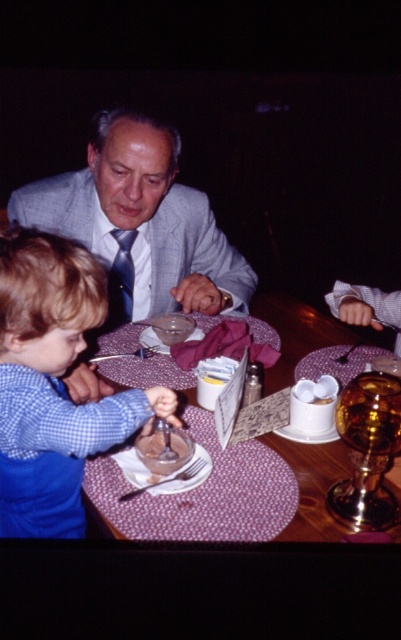
Question: Is wooden table at center in front of smooth chocolate pudding at center?

Choices:
 (A) no
 (B) yes

Answer: (B)

Question: Does blue checkered shirt at lower left have a larger size compared to smooth chocolate pudding at center?

Choices:
 (A) yes
 (B) no

Answer: (A)

Question: Which of the following is the farthest from the observer?

Choices:
 (A) (42, 204)
 (B) (297, 308)
 (C) (76, 349)

Answer: (B)

Question: Which of the following is the farthest from the observer?

Choices:
 (A) (153, 176)
 (B) (307, 532)

Answer: (A)

Question: Considering the real-world distances, which object is farthest from the wooden table at center?

Choices:
 (A) blue checkered shirt at lower left
 (B) gray suit at center

Answer: (A)

Question: Does gray suit at center lie behind smooth chocolate pudding at center?

Choices:
 (A) no
 (B) yes

Answer: (B)